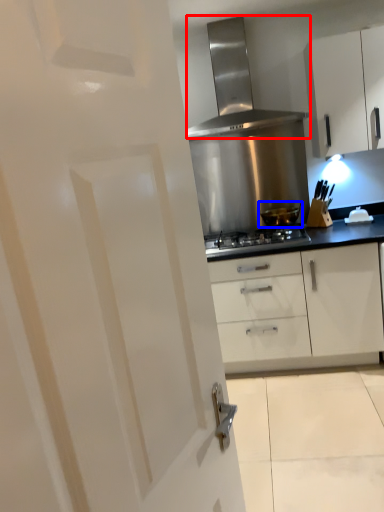
Question: Which object appears farthest to the camera in this image, home appliance (highlighted by a red box) or kitchen appliance (highlighted by a blue box)?

Choices:
 (A) home appliance
 (B) kitchen appliance

Answer: (B)